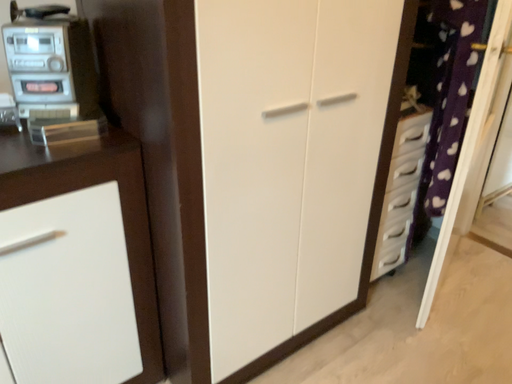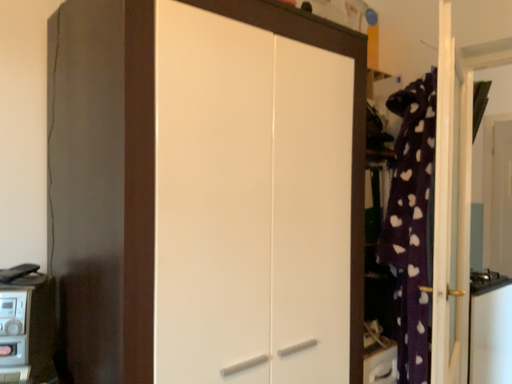
Question: How did the camera likely rotate when shooting the video?

Choices:
 (A) rotated upward
 (B) rotated downward

Answer: (A)